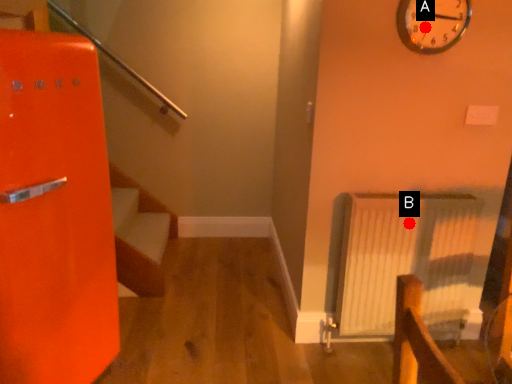
Question: Two points are circled on the image, labeled by A and B beside each circle. Which of the following is the closest to the observer?

Choices:
 (A) A is closer
 (B) B is closer

Answer: (A)